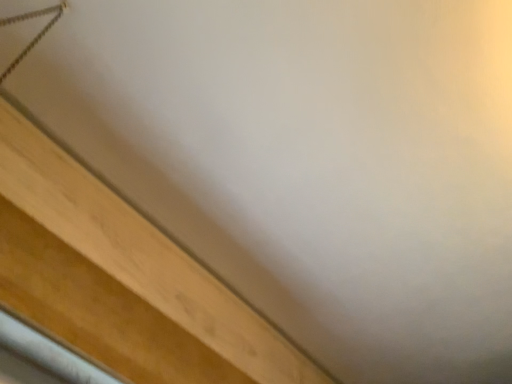
Question: Does point (18, 14) appear closer or farther from the camera than point (35, 178)?

Choices:
 (A) farther
 (B) closer

Answer: (B)

Question: From the image's perspective, relative to light wood plank at lower left, is metallic rope at upper left above or below?

Choices:
 (A) above
 (B) below

Answer: (A)

Question: From their relative heights in the image, would you say metallic rope at upper left is taller or shorter than light wood plank at lower left?

Choices:
 (A) tall
 (B) short

Answer: (A)

Question: From a real-world perspective, is light wood plank at lower left above or below metallic rope at upper left?

Choices:
 (A) above
 (B) below

Answer: (B)

Question: Relative to metallic rope at upper left, is light wood plank at lower left in front or behind?

Choices:
 (A) behind
 (B) front

Answer: (A)

Question: Looking at their shapes, would you say light wood plank at lower left is wider or thinner than metallic rope at upper left?

Choices:
 (A) wide
 (B) thin

Answer: (B)

Question: Based on their sizes in the image, would you say light wood plank at lower left is bigger or smaller than metallic rope at upper left?

Choices:
 (A) small
 (B) big

Answer: (B)